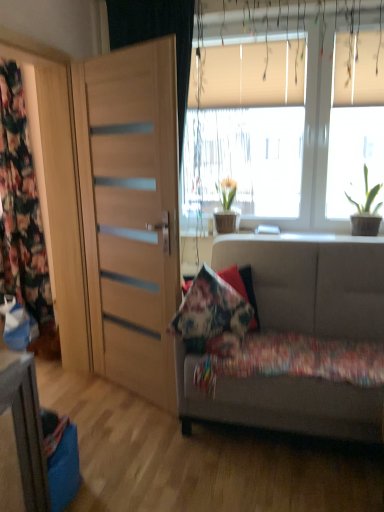
Locate an element on the screen. vacant space underneath light wood door at left (from a real-world perspective) is located at coordinates (130, 394).